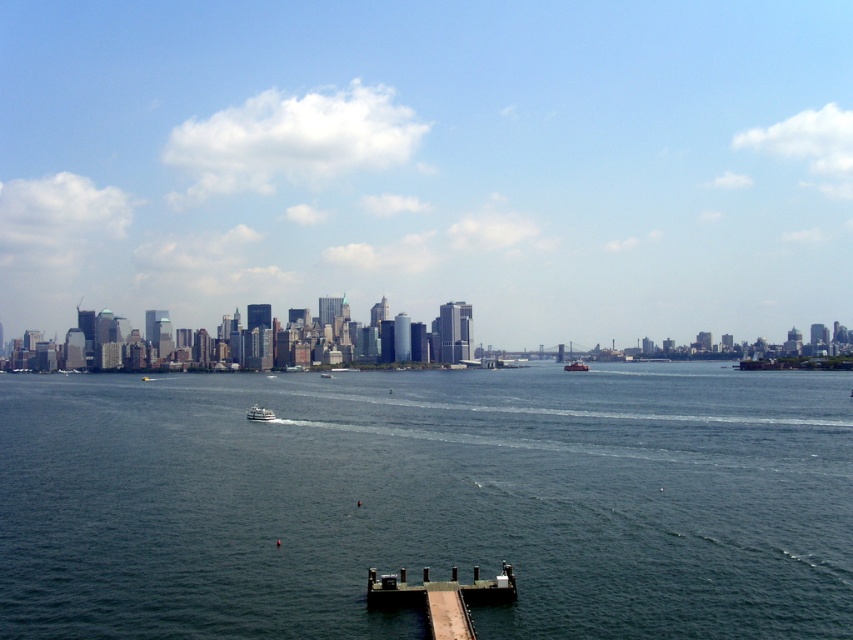
You are standing on the brown wooden dock at lower center and want to board the metallic gray ship at center. Is the dock large enough to accommodate the ship?

The brown wooden dock at lower center has a larger size compared to metallic gray ship at center, so yes, the dock is large enough to accommodate the ship.